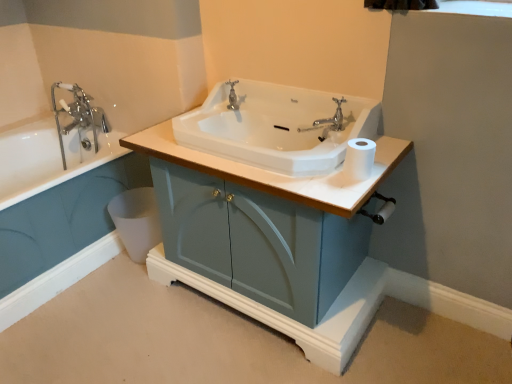
Question: Is chrome metallic faucet at upper left positioned with its back to white plastic toilet bowl at lower left?

Choices:
 (A) yes
 (B) no

Answer: (B)

Question: Are chrome metallic faucet at upper left and white plastic toilet bowl at lower left located far from each other?

Choices:
 (A) no
 (B) yes

Answer: (A)

Question: Is chrome metallic faucet at upper left positioned in front of white plastic toilet bowl at lower left?

Choices:
 (A) yes
 (B) no

Answer: (B)

Question: Does chrome metallic faucet at upper left contain white plastic toilet bowl at lower left?

Choices:
 (A) yes
 (B) no

Answer: (B)

Question: Is chrome metallic faucet at upper left bigger than white plastic toilet bowl at lower left?

Choices:
 (A) yes
 (B) no

Answer: (A)

Question: From a real-world perspective, does chrome metallic faucet at upper left sit lower than white plastic toilet bowl at lower left?

Choices:
 (A) no
 (B) yes

Answer: (A)

Question: Can you confirm if polished chrome faucet at center is taller than white matte toilet paper at right?

Choices:
 (A) yes
 (B) no

Answer: (A)

Question: From the image's perspective, would you say polished chrome faucet at center is shown under white matte toilet paper at right?

Choices:
 (A) yes
 (B) no

Answer: (B)

Question: Is white matte toilet paper at right inside polished chrome faucet at center?

Choices:
 (A) no
 (B) yes

Answer: (A)

Question: Is polished chrome faucet at center smaller than white matte toilet paper at right?

Choices:
 (A) yes
 (B) no

Answer: (A)

Question: Is polished chrome faucet at center completely or partially outside of white matte toilet paper at right?

Choices:
 (A) yes
 (B) no

Answer: (A)

Question: Does polished chrome faucet at center lie in front of white matte toilet paper at right?

Choices:
 (A) no
 (B) yes

Answer: (A)

Question: Is matte blue cabinet at center not inside white glossy sink at center?

Choices:
 (A) yes
 (B) no

Answer: (A)